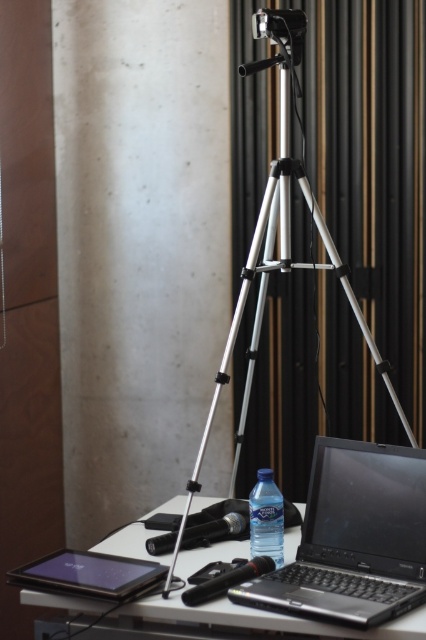
Where is the black plastic laptop at center located in the image?

The black plastic laptop at center is located at point (354, 538) in the image.

You are standing in front of the workspace setup. There are two points marked on the table surface. The first point is at coordinates point (x=354, y=516) and the second is at point (x=265, y=550). Which point is closer to you?

Point (x=354, y=516) is closer to the viewer than point (x=265, y=550).

You are setting up a camera for a presentation. The silver metallic tripod at center is placed on the white plastic table at center. Can you confirm if the tripod is securely anchored to the table?

The silver metallic tripod at center is 49.98 centimeters away from the white plastic table at center, which means it is not anchored to the table since the distance is greater than zero.